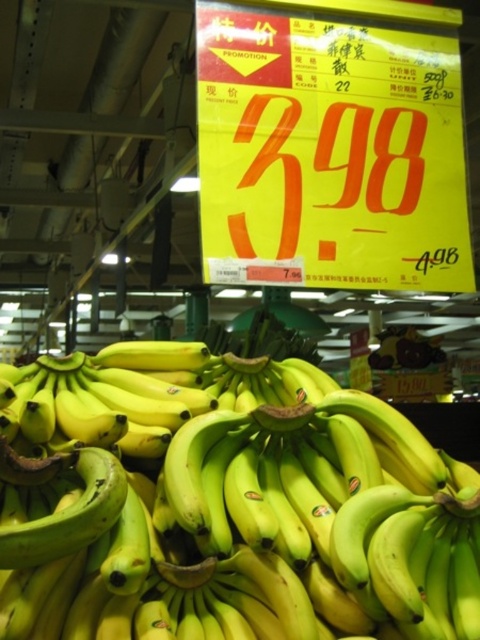
Does yellow matte bananas at center have a greater height compared to yellow paper sign at center?

In fact, yellow matte bananas at center may be shorter than yellow paper sign at center.

Locate an element on the screen. This screenshot has width=480, height=640. yellow matte bananas at center is located at coordinates click(232, 516).